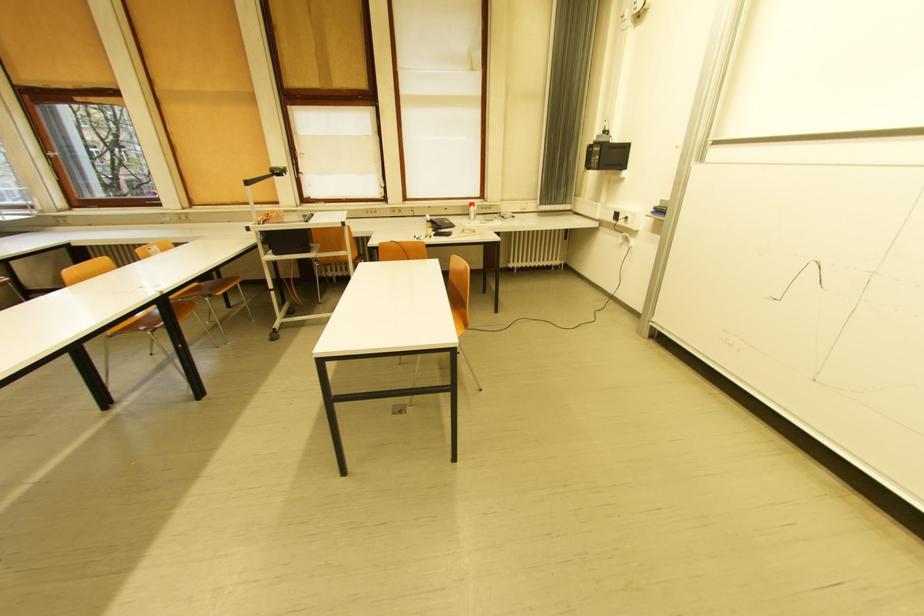
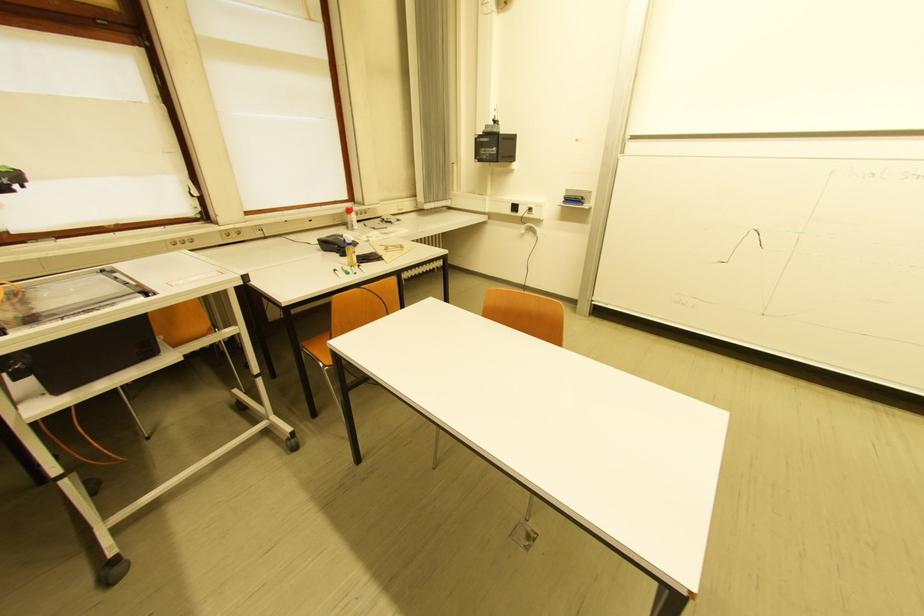
In the second image, find the point that corresponds to the point at 476,216 in the first image.

(351, 225)